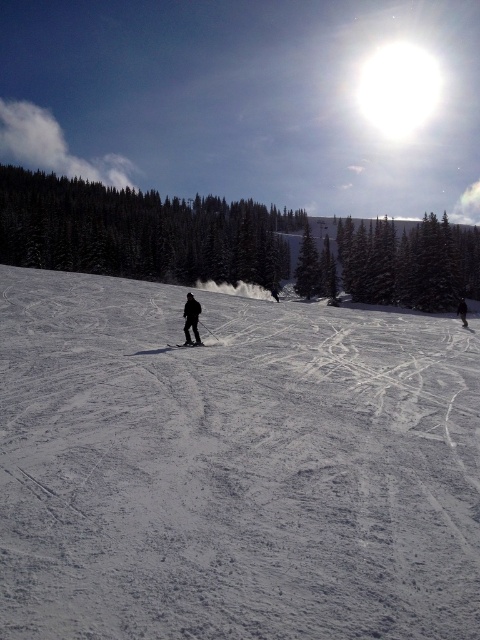
You are a photographer standing at the bottom of the ski slope. You want to take a photo of both point markers on the slope. Which point, point (184, 330) or point (201, 346), is closer to you when you take the photo?

Point (184, 330) is closer to you because it is further to the camera than point (201, 346).

You are planning to take a photo of the black matte skier at center from the foreground of the snow slope. Considering the ski tracks and the position of the skier, where should you position yourself to capture the skier in the center of your frame?

To capture the black matte skier at center in the center of your frame, position yourself at the foreground of the snow slope directly aligned with the skier located at point coordinates (191, 317).

You are a photographer planning to take a photo of the black matte skier at center and the black matte ski at center. You want to ensure both are clearly visible. Based on their positions, which object might be partially obscured in the photo?

The black matte ski at center is behind the black matte skier at center, so it might be partially obscured in the photo.